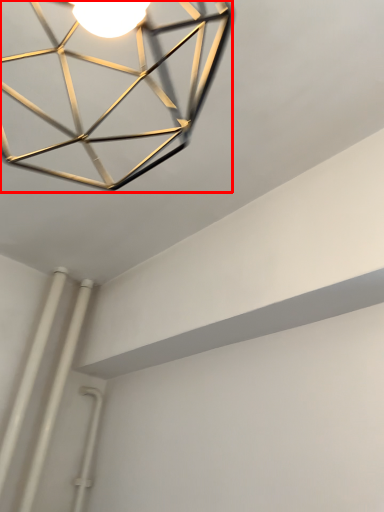
Question: Observing the image, what is the correct spatial positioning of lamp (annotated by the red box) in reference to pipe?

Choices:
 (A) right
 (B) left

Answer: (A)